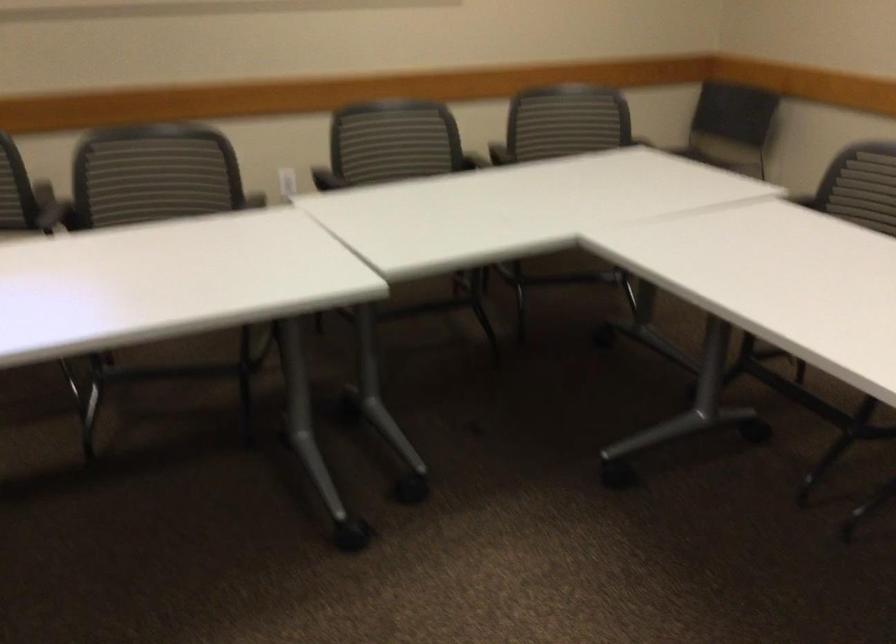
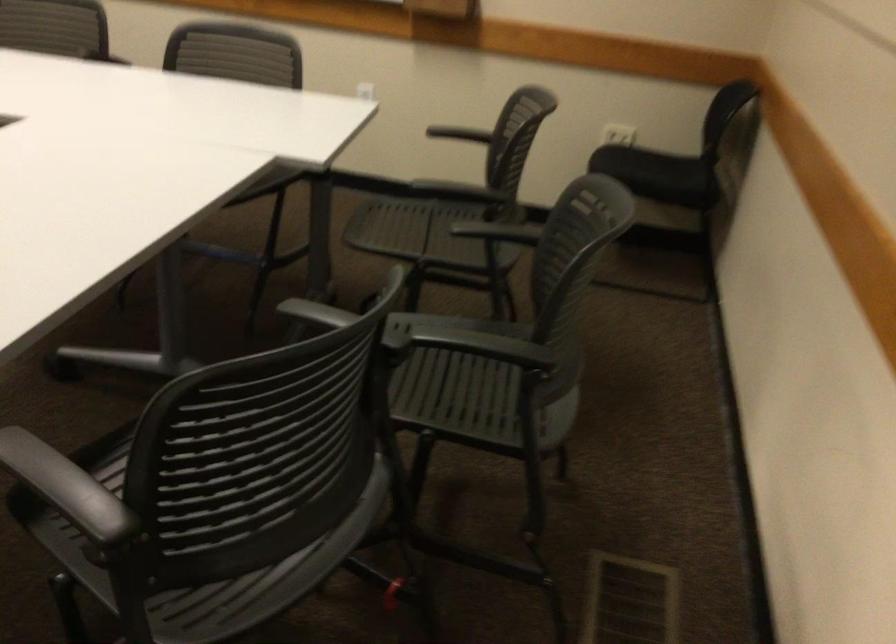
The point at (230, 181) is marked in the first image. Where is the corresponding point in the second image?

(141, 440)